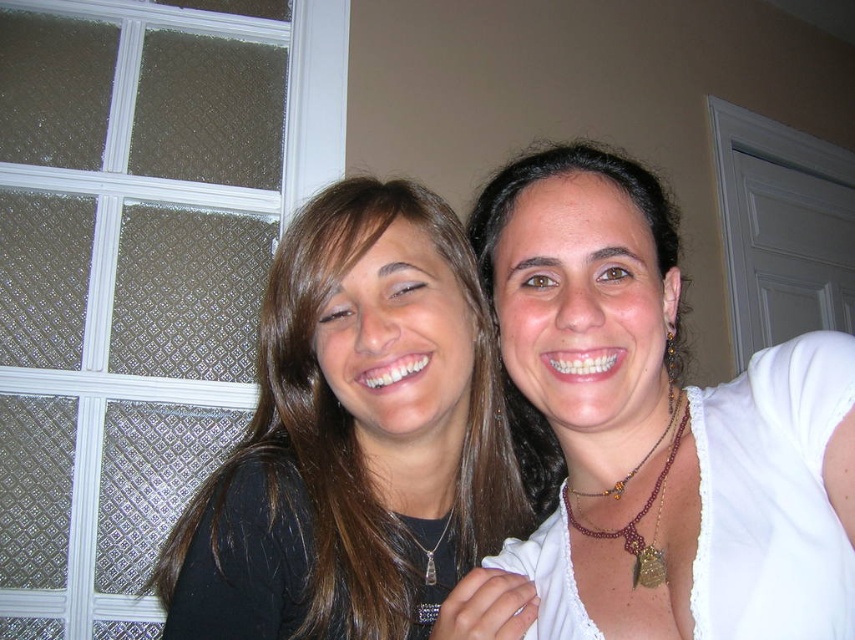
Is white matte necklace at upper right further to camera compared to silver/glass pendant at center?

No, it is not.

Does point (850, 573) lie in front of point (426, 572)?

That is True.

Image resolution: width=855 pixels, height=640 pixels. I want to click on white matte necklace at upper right, so click(652, 433).

Who is taller, beaded burgundy necklace at upper right or silver/glass pendant at center?

beaded burgundy necklace at upper right is taller.

Locate an element on the screen. beaded burgundy necklace at upper right is located at coordinates (641, 506).

Can you confirm if matte black shirt at center is wider than beaded burgundy necklace at upper right?

Indeed, matte black shirt at center has a greater width compared to beaded burgundy necklace at upper right.

Who is more distant from viewer, (354,180) or (687,410)?

The point (354,180) is behind.

Describe the element at coordinates (354, 436) in the screenshot. The height and width of the screenshot is (640, 855). I see `matte black shirt at center` at that location.

This screenshot has width=855, height=640. I want to click on matte black shirt at center, so click(354, 436).